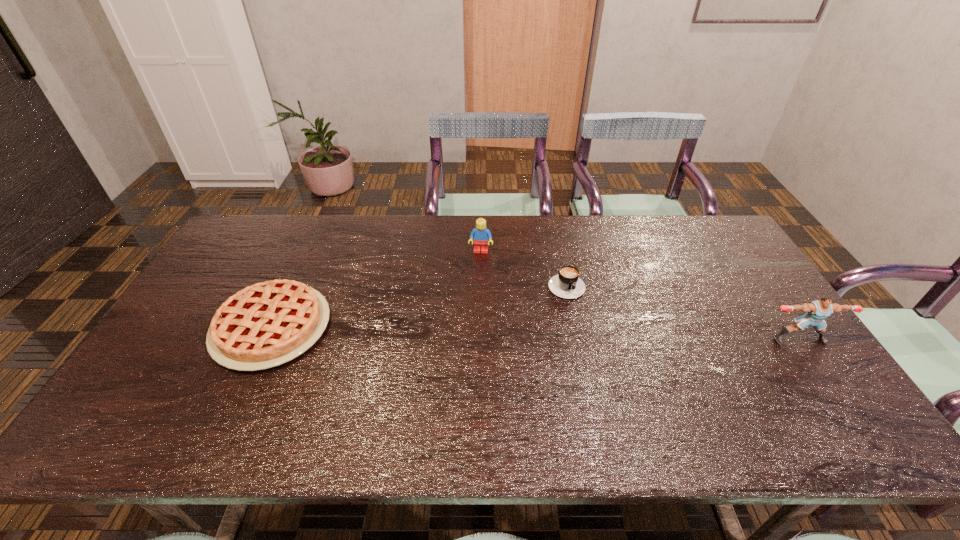
Locate an element on the screen. The image size is (960, 540). vacant space on the desktop that is between the pie and the tallest object and is positioned on the face of the third object from right to left is located at coordinates (471, 332).

Where is `vacant spot on the desktop that is between the pie and the tallest object and is positioned with the handle on the side of the third object from left to right`? Image resolution: width=960 pixels, height=540 pixels. vacant spot on the desktop that is between the pie and the tallest object and is positioned with the handle on the side of the third object from left to right is located at coordinates (588, 334).